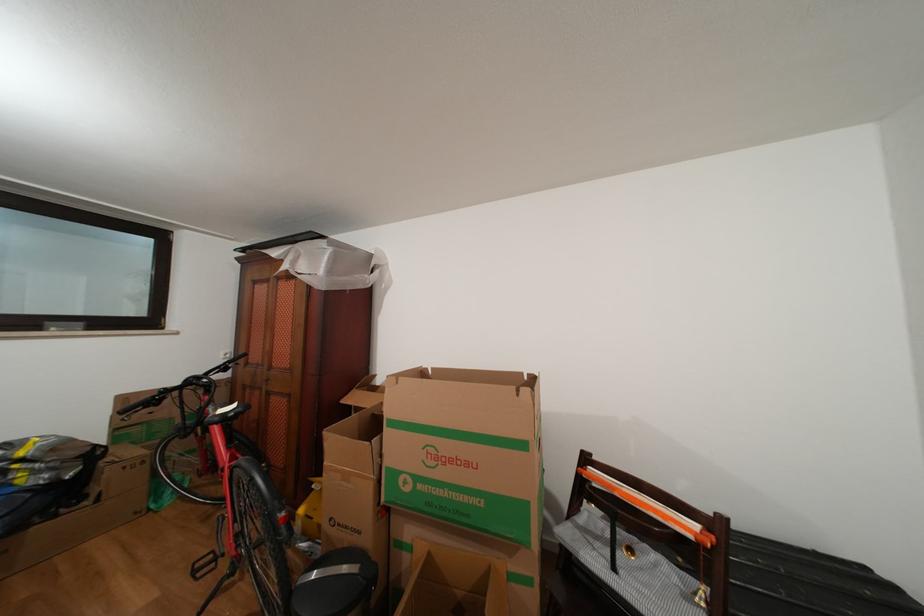
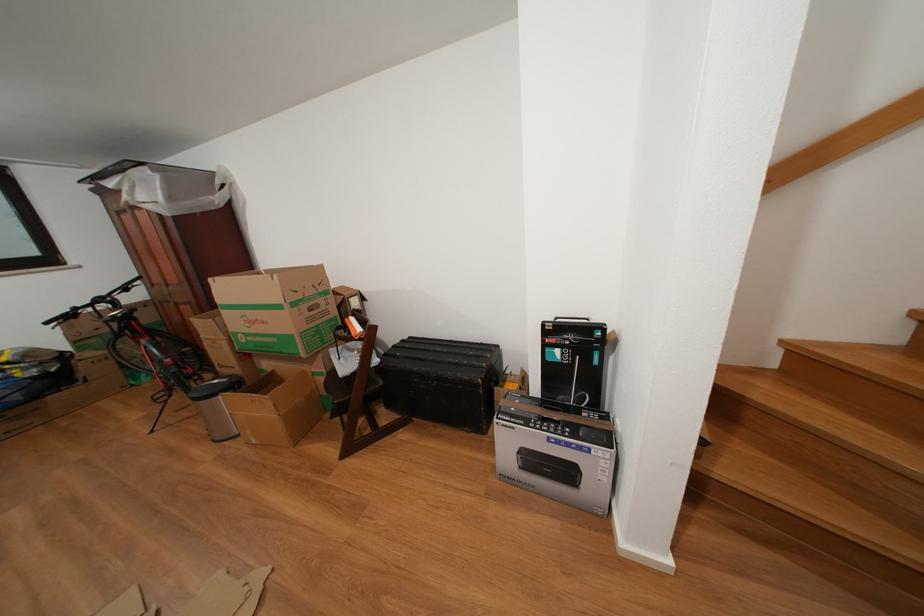
The point at (823, 559) is marked in the first image. Where is the corresponding point in the second image?

(490, 349)